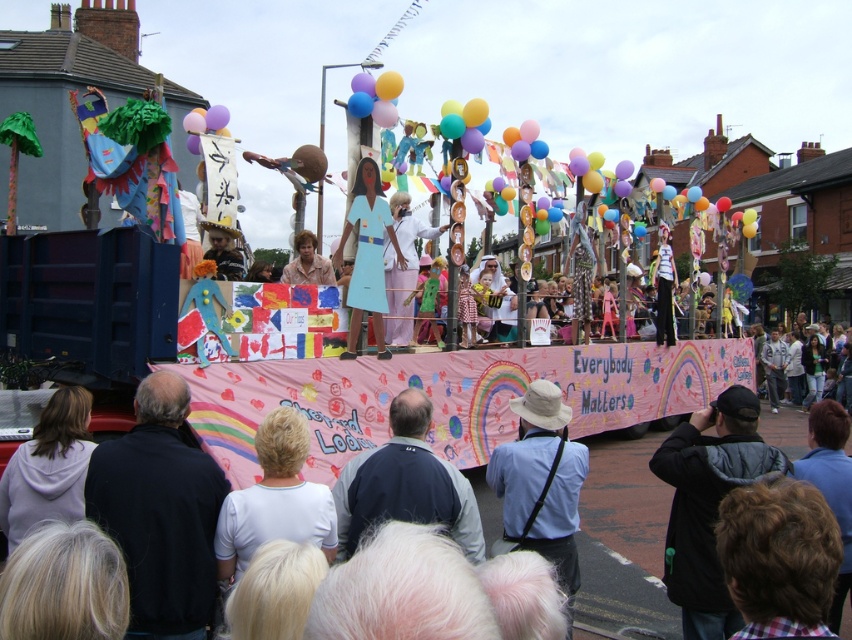
Between light blue fabric dress at center and pink fabric dress at center, which one is positioned higher?

light blue fabric dress at center is above.

From the picture: Does light blue fabric dress at center have a lesser width compared to pink fabric dress at center?

No.

Does point (360, 193) come in front of point (392, 253)?

Yes, it is.

Locate an element on the screen. The image size is (852, 640). light blue fabric dress at center is located at coordinates pyautogui.click(x=367, y=257).

Does black fabric at lower left appear on the left side of brown hair at lower right?

Indeed, black fabric at lower left is positioned on the left side of brown hair at lower right.

Which of these two, black fabric at lower left or brown hair at lower right, stands shorter?

With less height is brown hair at lower right.

I want to click on black fabric at lower left, so click(160, 513).

From the picture: Can you confirm if brown hair at lower right is positioned to the right of light blue fabric dress at center?

Yes, brown hair at lower right is to the right of light blue fabric dress at center.

Who is more forward, (764, 636) or (367, 243)?

Point (764, 636)

The image size is (852, 640). Find the location of `brown hair at lower right`. brown hair at lower right is located at coordinates (778, 556).